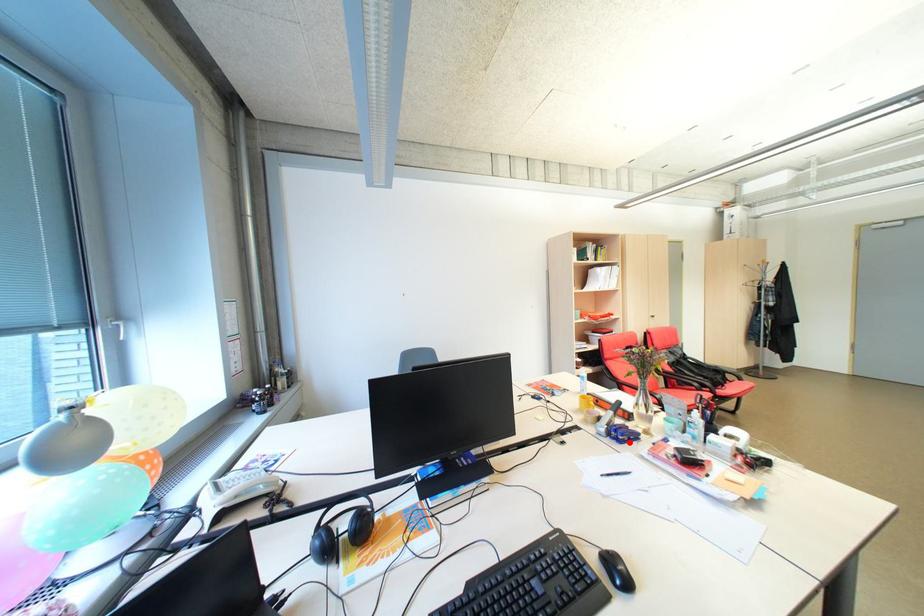
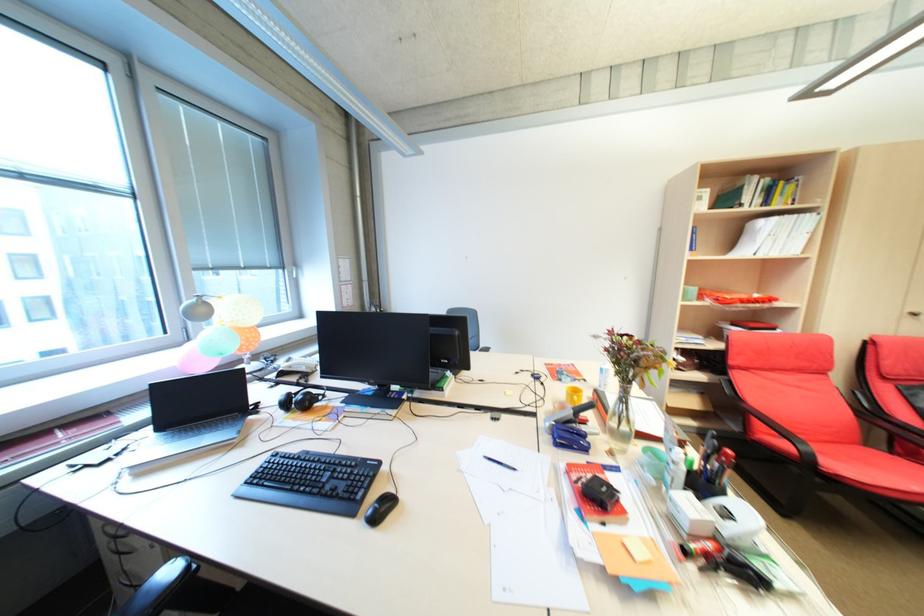
Locate, in the second image, the point that corresponds to the highlighted location in the first image.

(565, 445)